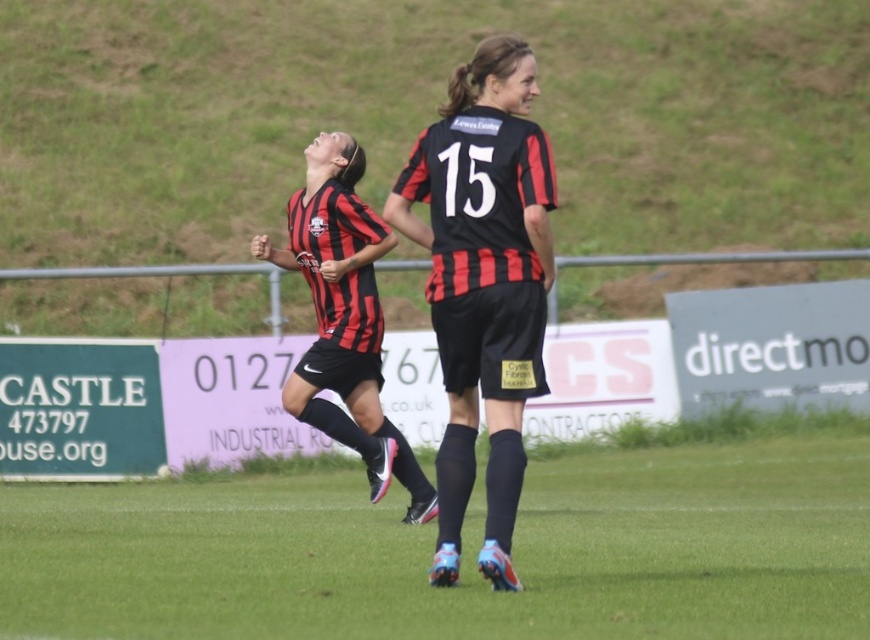
You are a soccer coach analyzing the players in the image. You see two points marked on the field, point A at coordinates point (205, 634) and point B at coordinates point (373, 486). Which point is closer to the camera?

Point (205, 634) is closer to the viewer than point (373, 486).

In the scene shown: You are a photographer trying to capture a closeup of the matte black soccer jersey at center. Given that the green grass at center takes up more space in the frame, will the jersey still be visible in the photo?

The green grass at center is larger in size than the matte black soccer jersey at center, so the jersey will still be visible but smaller in the frame compared to the grass.

You are a photographer trying to capture both players in a single shot. Since the matte black jersey at center and the matte black soccer jersey at center are positioned close to each other, which one do you need to focus on more to ensure the other remains in the frame?

The matte black jersey at center has a lesser width compared to the matte black soccer jersey at center, so you should focus on the wider matte black soccer jersey at center to ensure the narrower one stays in the frame.